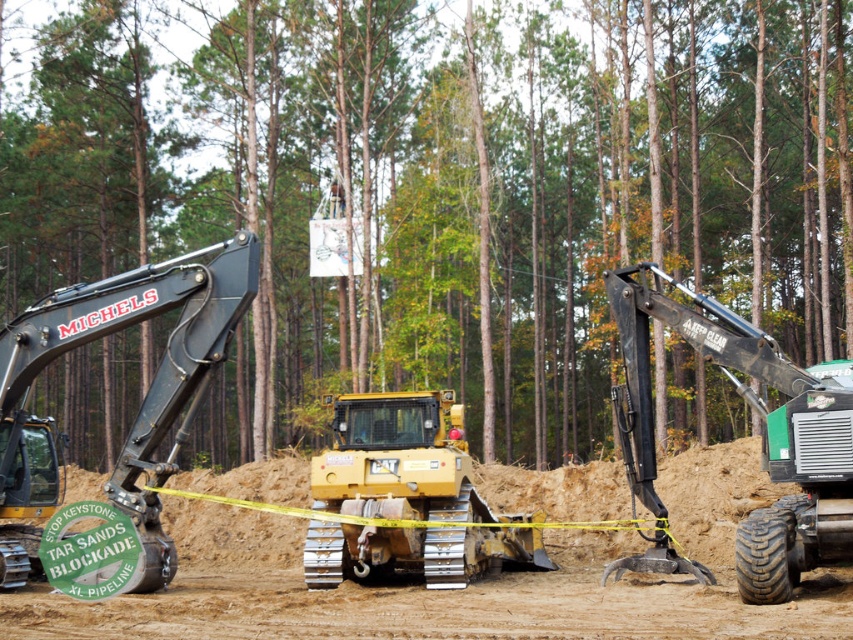
You are a delivery truck driver who needs to unload a heavy crate weighing 2000 pounds onto the construction site. The crate must be placed between the brown sandy dirt at center and the yellow rubber tracked tractor at center. Given that the minimum safe distance required between the crate and any machinery is 5 feet, can you safely place the crate in that location?

The brown sandy dirt at center and yellow rubber tracked tractor at center are 6.85 feet apart from each other. Since the minimum safe distance required is 5 feet, placing the crate between them would be possible as long as it stays within the 6.85 feet gap. However, the exact placement must ensure the crate is at least 5 feet away from both the tractor and the sandy dirt area. Since the total distance is more than 5 feet, it is feasible if positioned correctly.

You are a safety inspector on the construction site. You need to ensure that the green leafy tree at center and the yellow rubber tracked vehicle at center are positioned safely. Based on their positions, which one is higher up?

The green leafy tree at center is located above the yellow rubber tracked vehicle at center, so the tree is higher up.